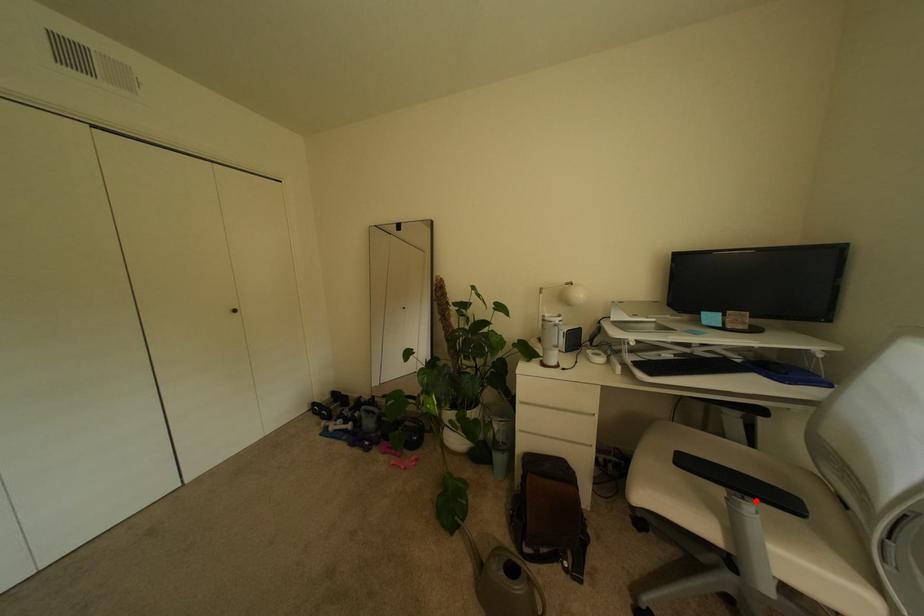
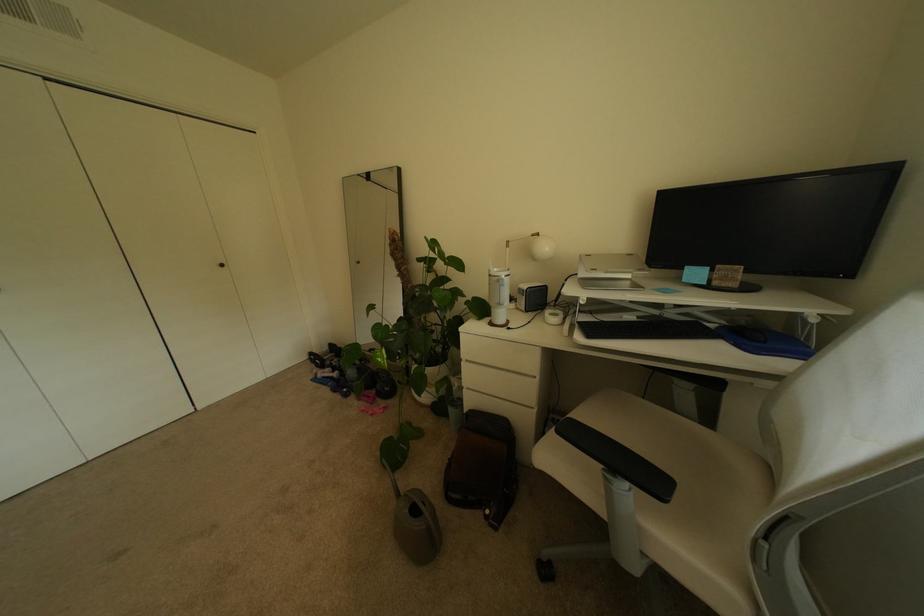
Locate, in the second image, the point that corresponds to the highlighted location in the first image.

(626, 477)